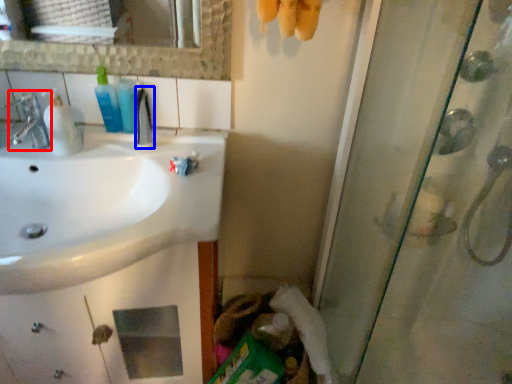
Question: Among these objects, which one is nearest to the camera, tap (highlighted by a red box) or mouthwash (highlighted by a blue box)?

Choices:
 (A) tap
 (B) mouthwash

Answer: (A)